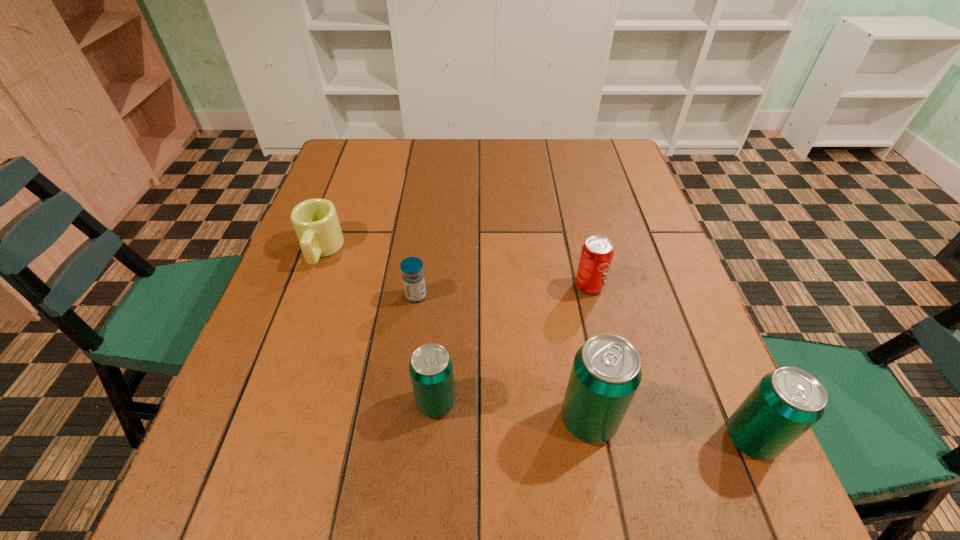
The beer cans are evenly distributed in the image. To maintain this, where would you place another beer can on the left? Please point to a free space. Please provide its 2D coordinates. Your answer should be formatted as a tuple, i.e. [(x, y)], where the tuple contains the x and y coordinates of a point satisfying the conditions above.

[(292, 386)]